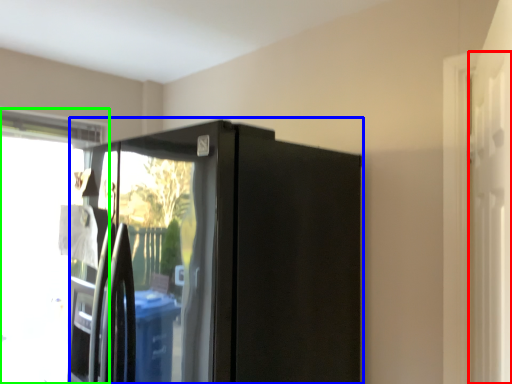
Question: Which object is positioned closest to screen door (highlighted by a red box)? Select from appliance (highlighted by a blue box) and window (highlighted by a green box).

Choices:
 (A) appliance
 (B) window

Answer: (A)